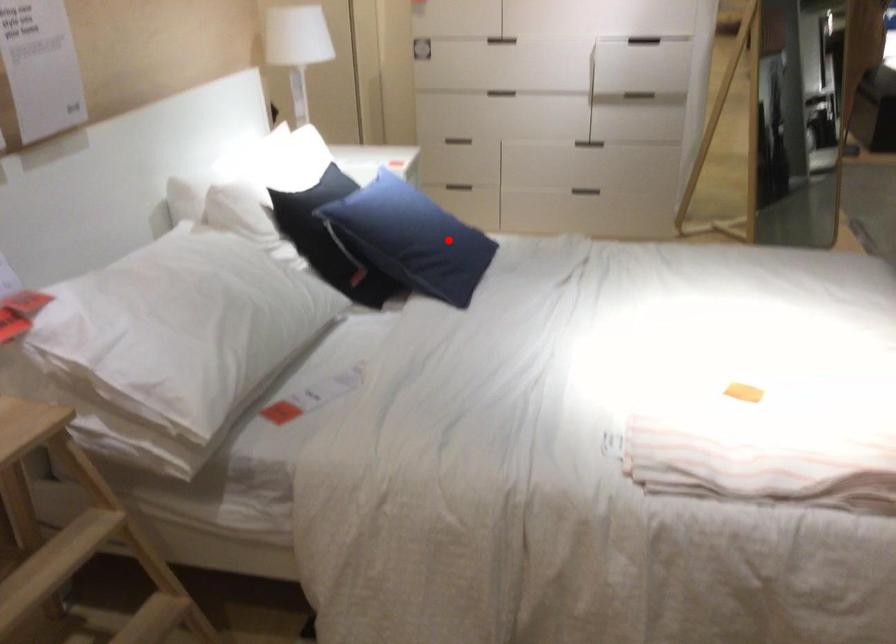
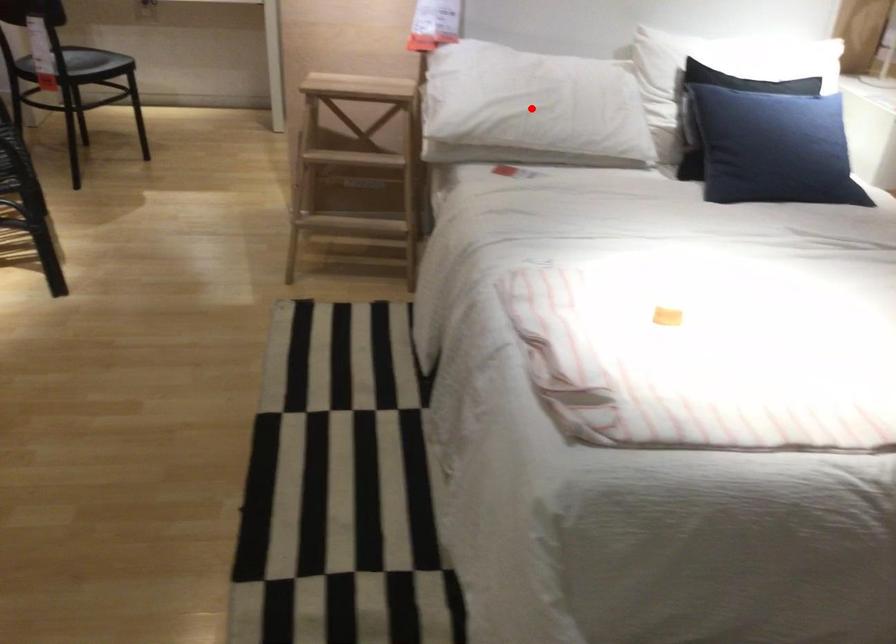
I am providing you with two images of the same scene from different viewpoints. A red point is marked on the first image and another point is marked on the second image. Are the points marked in image1 and image2 representing the same 3D position?

No